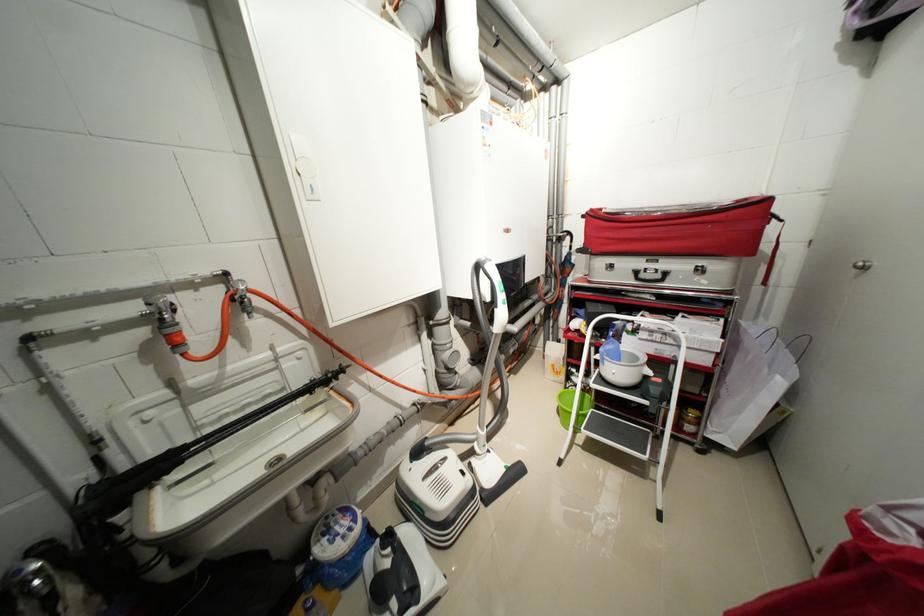
This screenshot has height=616, width=924. I want to click on black suitcase handle, so click(681, 229).